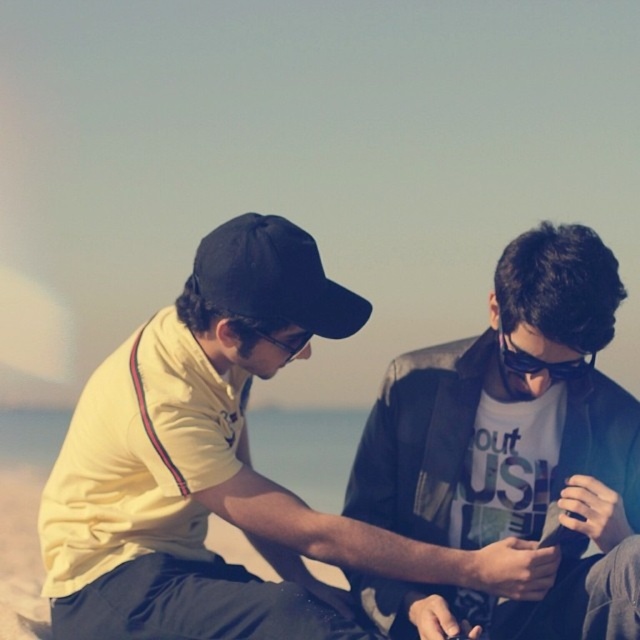
Does yellow fabric shirt at center come behind black matte goggles at center?

No, yellow fabric shirt at center is in front of black matte goggles at center.

You are a GUI agent. You are given a task and a screenshot of the screen. Output one action in this format:
    pyautogui.click(x=<x>, y=<y>)
    Task: Click on the yellow fabric shirt at center
    Image resolution: width=640 pixels, height=640 pixels.
    Given the screenshot: What is the action you would take?
    pyautogui.click(x=221, y=468)

Who is shorter, yellow fabric shirt at center or black matte baseball cap at center?

black matte baseball cap at center

Is point (97, 566) positioned behind point (221, 260)?

Yes, point (97, 566) is farther from viewer.

Find the location of a particular element. The image size is (640, 640). yellow fabric shirt at center is located at coordinates (221, 468).

Looking at this image, can you confirm if matte black shirt at center is shorter than black matte goggles at center?

Incorrect, matte black shirt at center's height does not fall short of black matte goggles at center's.

What do you see at coordinates (512, 451) in the screenshot? I see `matte black shirt at center` at bounding box center [512, 451].

Where is `matte black shirt at center`? The width and height of the screenshot is (640, 640). matte black shirt at center is located at coordinates (512, 451).